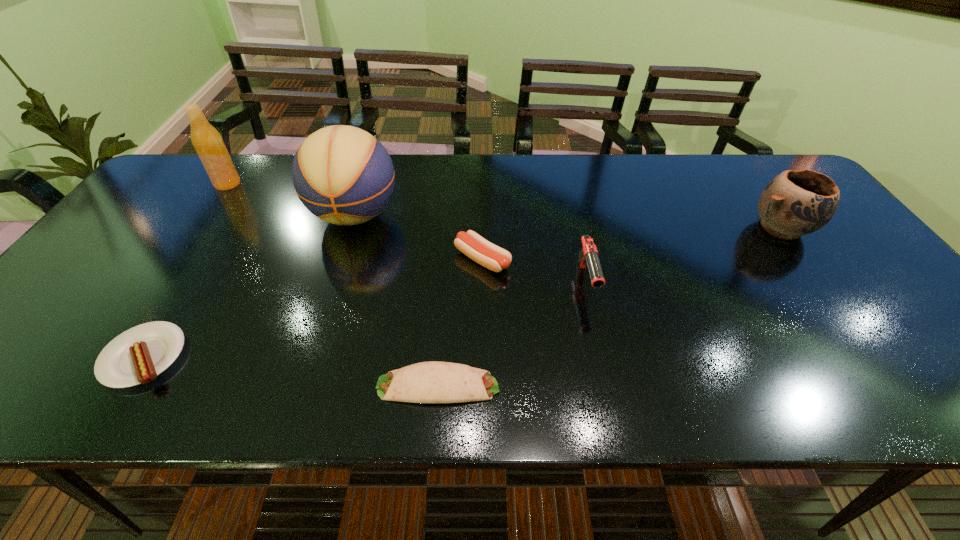
You are a GUI agent. You are given a task and a screenshot of the screen. Output one action in this format:
    pyautogui.click(x=<x>, y=<y>)
    Task: Click on the burrito
    Image resolution: width=960 pixels, height=540 pixels.
    Given the screenshot: What is the action you would take?
    pyautogui.click(x=427, y=382)

At what (x,y) coordinates should I click in order to perform the action: click on vacant area located 0.370m on the patterned surface of the basketball. Please return your answer as a coordinate pair (x, y). Looking at the image, I should click on (306, 368).

Identify the location of blank space located on the front of the beer bottle. (160, 281).

You are a GUI agent. You are given a task and a screenshot of the screen. Output one action in this format:
    pyautogui.click(x=<x>, y=<y>)
    Task: Click on the blank space located on the back of the third tallest object
    
    Given the screenshot: What is the action you would take?
    pyautogui.click(x=729, y=156)

Find the location of a particular element. This screenshot has width=960, height=540. vacant area situated 0.050m at the aiming end of the fourth shortest object is located at coordinates (596, 326).

Where is `free point located 0.370m on the back of the third shortest object`? free point located 0.370m on the back of the third shortest object is located at coordinates tap(482, 165).

Where is `free region located on the right of the left sausage`? This screenshot has height=540, width=960. free region located on the right of the left sausage is located at coordinates (237, 357).

At what (x,y) coordinates should I click in order to perform the action: click on blank area located 0.090m at the bitten end of the burrito. Please return your answer as a coordinate pair (x, y). Image resolution: width=960 pixels, height=540 pixels. Looking at the image, I should click on (545, 386).

What are the coordinates of `basketball present at the far edge` in the screenshot? It's located at (342, 174).

You are a GUI agent. You are given a task and a screenshot of the screen. Output one action in this format:
    pyautogui.click(x=<x>, y=<y>)
    Task: Click on the beer bottle positioned at the far edge
    
    Given the screenshot: What is the action you would take?
    pyautogui.click(x=207, y=141)